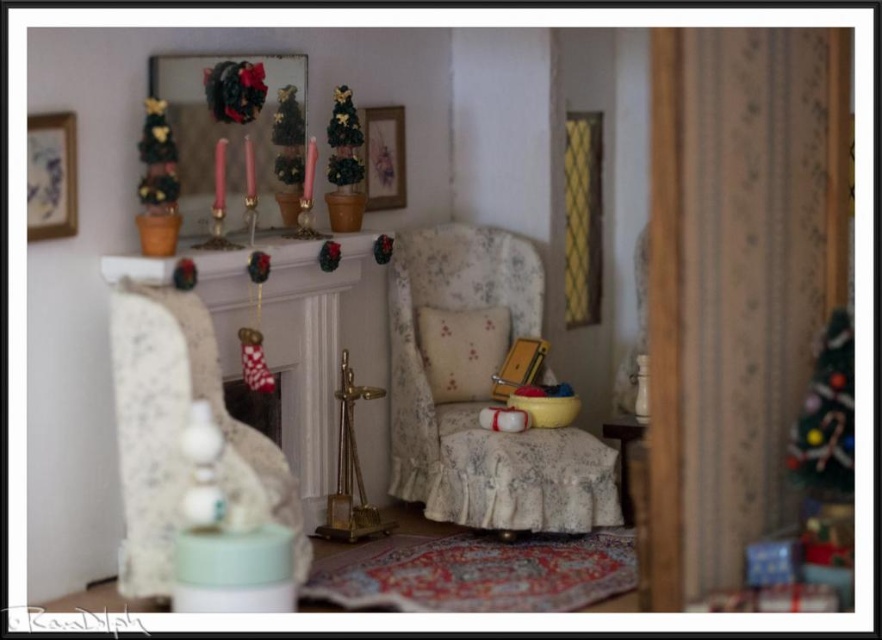
Question: Which object is positioned closest to the green felt christmas tree at right?

Choices:
 (A) blue paper picture frame at upper left
 (B) matte gold picture frame at upper center

Answer: (B)

Question: Which point is closer to the camera?

Choices:
 (A) (522, 481)
 (B) (499, 499)
 (C) (355, 477)

Answer: (B)

Question: Among these points, which one is farthest from the camera?

Choices:
 (A) (815, 400)
 (B) (475, 496)
 (C) (335, 515)

Answer: (C)

Question: Is floral fabric armchair at center thinner than floral fabric stool at center?

Choices:
 (A) no
 (B) yes

Answer: (A)

Question: Is floral fabric stool at center further to the viewer compared to matte gold picture frame at upper center?

Choices:
 (A) yes
 (B) no

Answer: (B)

Question: From the image, what is the correct spatial relationship of floral fabric stool at center in relation to green felt christmas tree at right?

Choices:
 (A) right
 (B) left

Answer: (B)